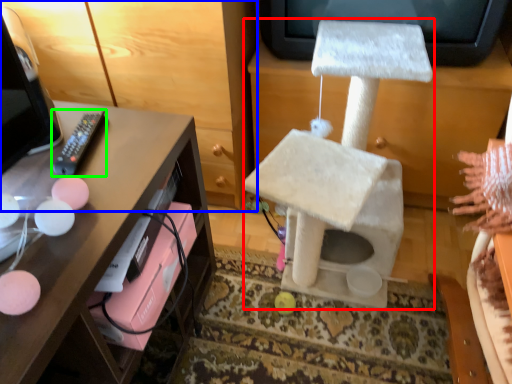
Question: Estimate the real-world distances between objects in this image. Which object is closer to swivel chair (highlighted by a red box), furniture (highlighted by a blue box) or remote (highlighted by a green box)?

Choices:
 (A) furniture
 (B) remote

Answer: (A)